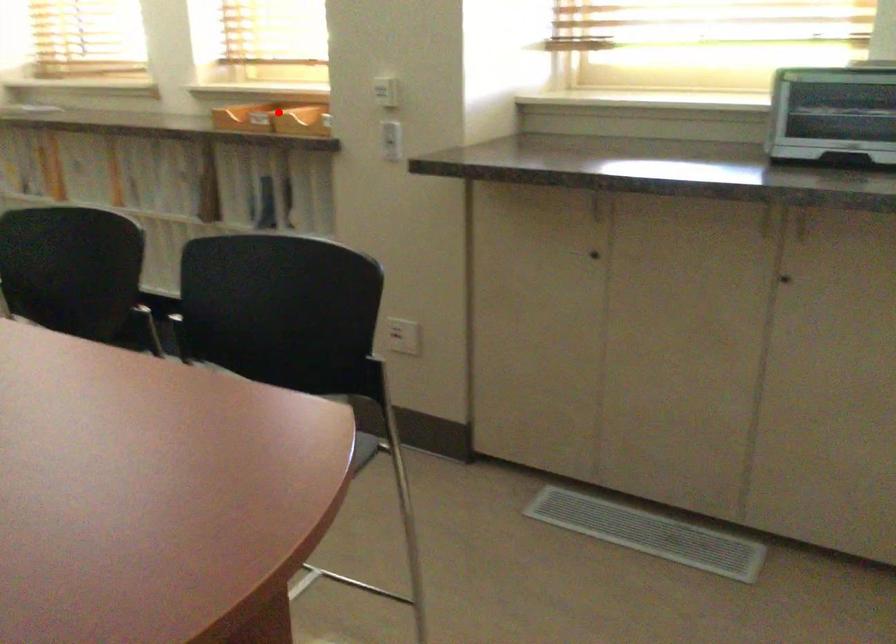
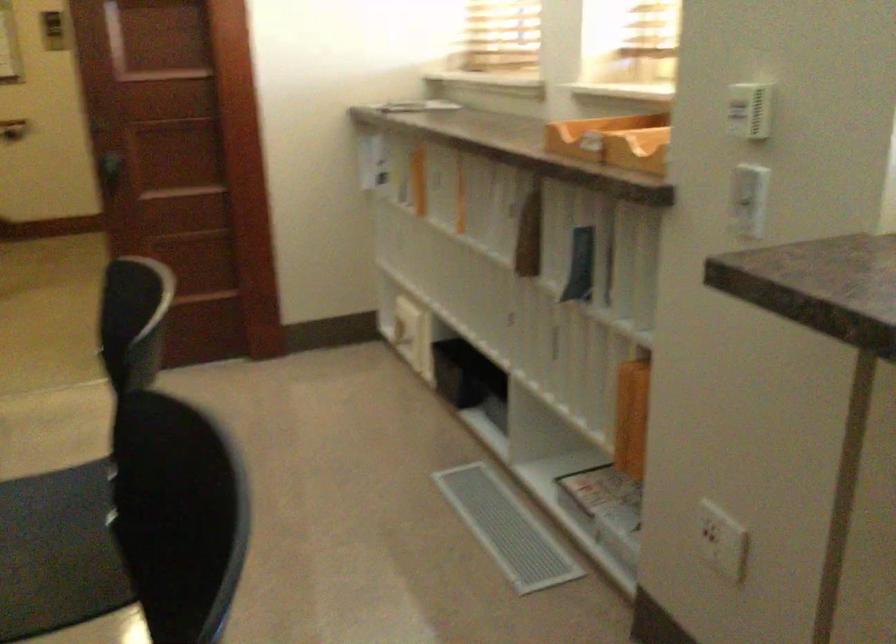
Question: I am providing you with two images of the same scene from different viewpoints. Given a red point in image1, look at the same physical point in image2. Is it:

Choices:
 (A) Closer to the viewpoint
 (B) Farther from the viewpoint

Answer: (A)